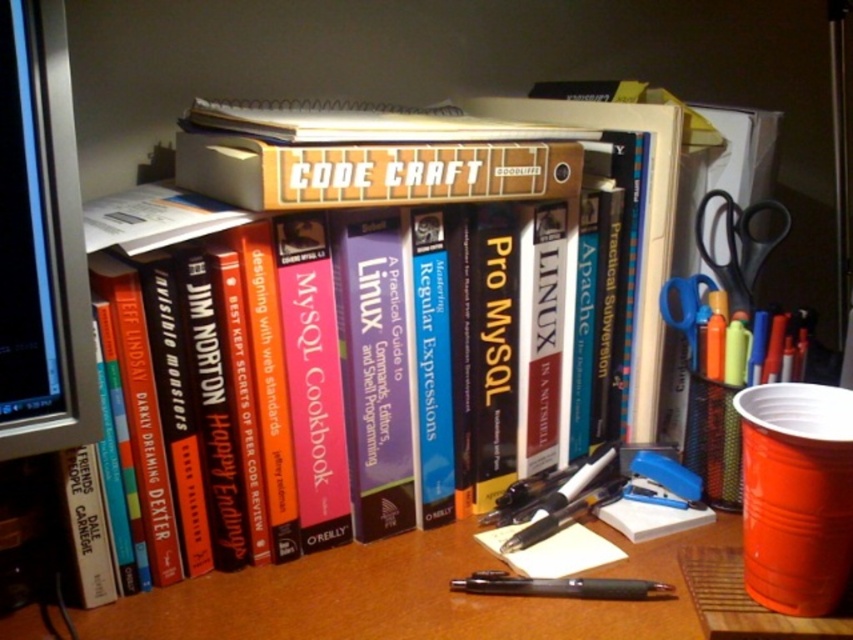
Looking at this image, between brown wooden table at center and blue plastic scissors at right, which one has more height?

blue plastic scissors at right is taller.

Can you confirm if brown wooden table at center is shorter than blue plastic scissors at right?

Yes, brown wooden table at center is shorter than blue plastic scissors at right.

The height and width of the screenshot is (640, 853). What are the coordinates of `brown wooden table at center` in the screenshot? It's located at (410, 595).

Can you confirm if hardcover book at center is bigger than blue plastic scissors at right?

Indeed, hardcover book at center has a larger size compared to blue plastic scissors at right.

Does hardcover book at center have a greater width compared to blue plastic scissors at right?

Correct, the width of hardcover book at center exceeds that of blue plastic scissors at right.

Identify the location of hardcover book at center. This screenshot has width=853, height=640. (368, 173).

Locate an element on the screen. Image resolution: width=853 pixels, height=640 pixels. brown wooden table at center is located at coordinates (410, 595).

Which is more to the right, brown wooden table at center or matte black monitor at left?

Positioned to the right is brown wooden table at center.

Is point (366, 576) more distant than point (4, 161)?

Yes.

Where is `brown wooden table at center`? The height and width of the screenshot is (640, 853). brown wooden table at center is located at coordinates (410, 595).